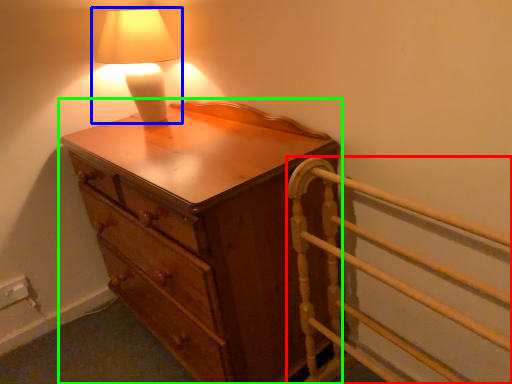
Question: Estimate the real-world distances between objects in this image. Which object is closer to bed frame (highlighted by a red box), lamp (highlighted by a blue box) or chest of drawers (highlighted by a green box)?

Choices:
 (A) lamp
 (B) chest of drawers

Answer: (B)